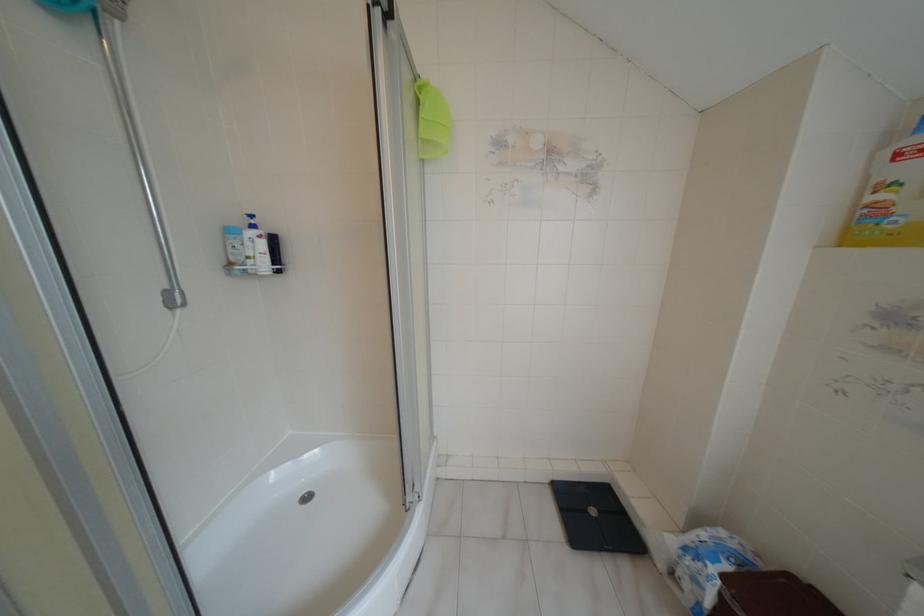
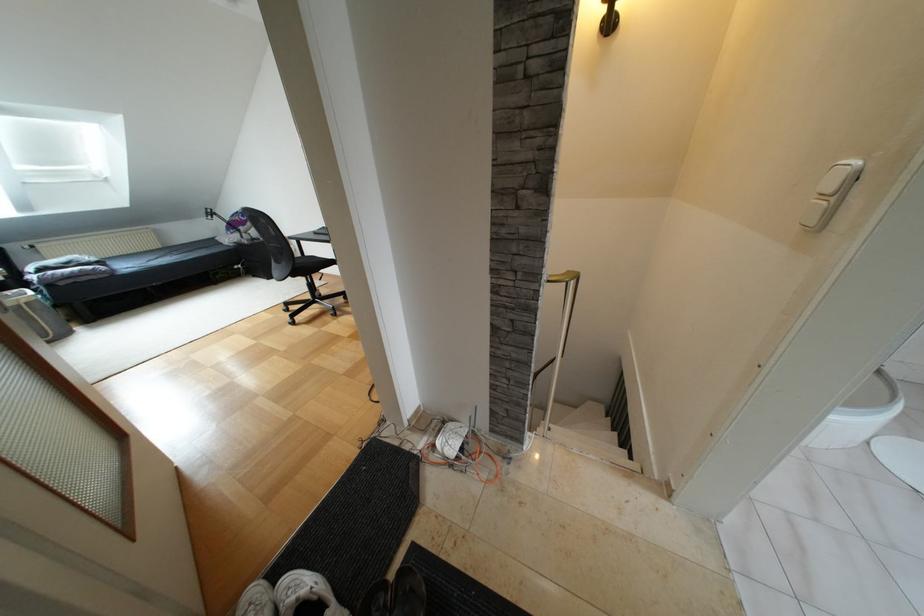
What movement of the cameraman would produce the second image?

The cameraman moved toward left, backward.